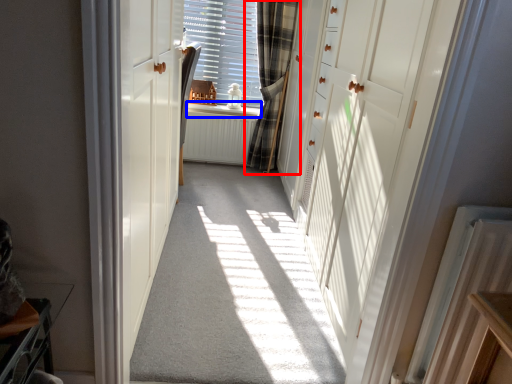
Question: Which of the following is the farthest to the observer, curtain (highlighted by a red box) or window sill (highlighted by a blue box)?

Choices:
 (A) curtain
 (B) window sill

Answer: (B)